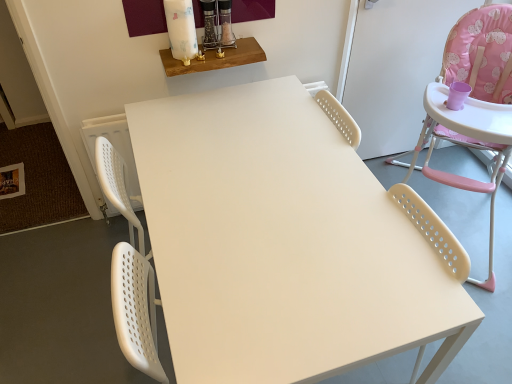
Question: Is pink fabric highchair at right in front of or behind matte white table at center, which ranks as the 2th table in back-to-front order, in the image?

Choices:
 (A) front
 (B) behind

Answer: (B)

Question: Does point (490, 61) appear closer or farther from the camera than point (360, 329)?

Choices:
 (A) closer
 (B) farther

Answer: (B)

Question: Based on their relative distances, which object is nearer to the wooden shelf at upper center, which is the 2th table from right to left?

Choices:
 (A) pink fabric highchair at right
 (B) matte white table at center, which ranks as the first table in front-to-back order

Answer: (B)

Question: Which is nearer to the wooden shelf at upper center, which is counted as the 1th table, starting from the top?

Choices:
 (A) pink fabric highchair at right
 (B) matte white table at center, which ranks as the first table in front-to-back order

Answer: (B)